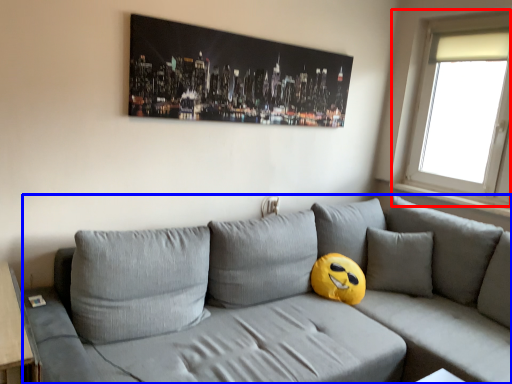
Question: Which point is further to the camera, window (highlighted by a red box) or studio couch (highlighted by a blue box)?

Choices:
 (A) window
 (B) studio couch

Answer: (A)